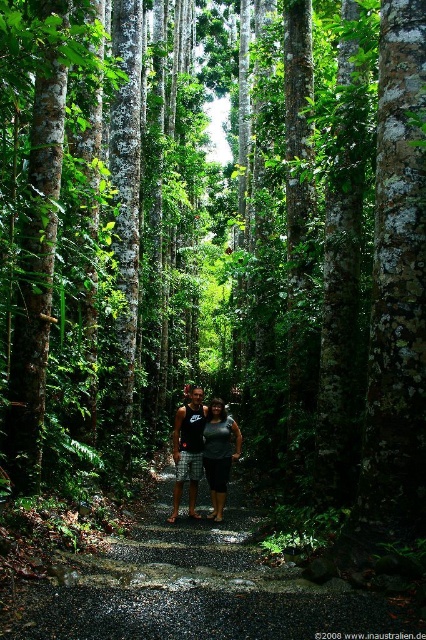
Based on the photo, who is more forward, (181, 435) or (215, 500)?

Point (215, 500) is more forward.

From the picture: Does matte black tank top at center have a greater height compared to matte gray shorts at center?

Yes.

In order to click on matte black tank top at center in this screenshot , I will do `click(192, 444)`.